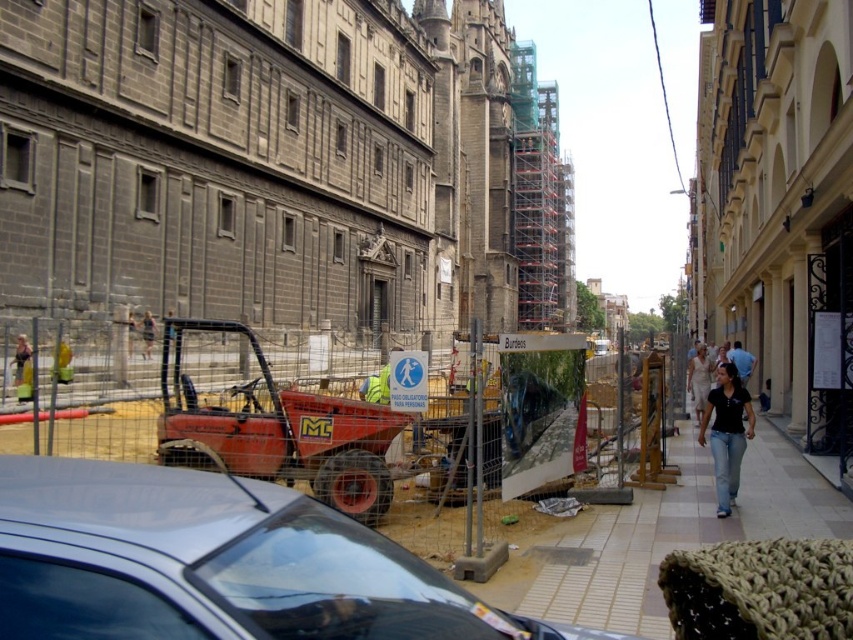
You are a pedestrian walking on the smooth concrete sidewalk at center. There is a silver metallic car at center in front of you. Can you safely walk around the car without stepping off the sidewalk?

The silver metallic car at center is closer to the viewer than the smooth concrete sidewalk at center, meaning the car is blocking the sidewalk. Therefore, you cannot safely walk around the car without stepping off the sidewalk.

You are a pedestrian standing on the sidewalk and see the silver metallic car at center and the black matte shirt at center in the scene. Which object is nearer to you?

The silver metallic car at center is closer to you than the black matte shirt at center.

You are a delivery person trying to navigate through the urban street scene. You need to move a large package from the forklift to the sidewalk. Considering the smooth concrete sidewalk at center and the black matte shirt at center, which object is wider and can accommodate the package more easily?

The smooth concrete sidewalk at center is wider than the black matte shirt at center, so it can accommodate the package more easily.